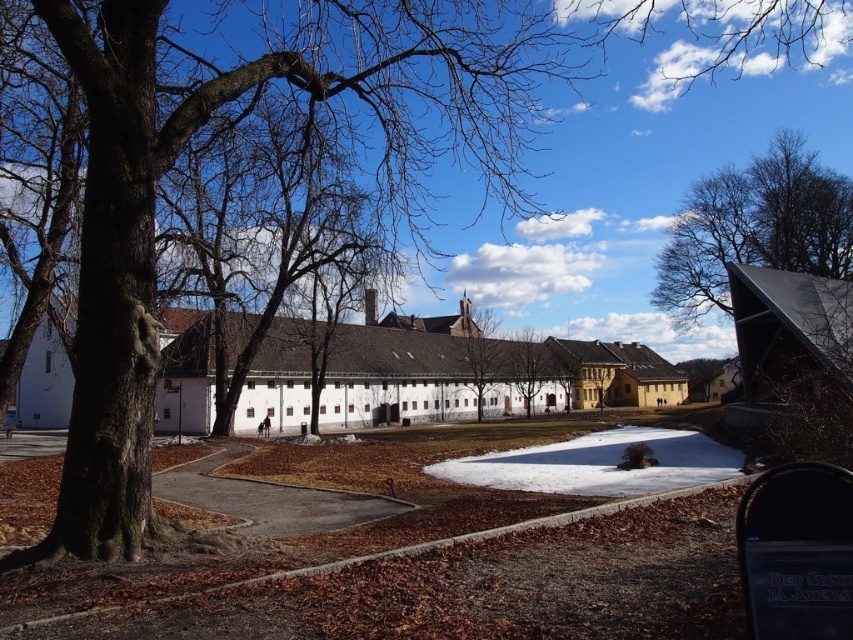
Is white matte building at center wider than bare branches at upper right?

Yes, white matte building at center is wider than bare branches at upper right.

Measure the distance between white matte building at center and camera.

They are 25.97 meters apart.

Locate an element on the screen. The image size is (853, 640). white matte building at center is located at coordinates (480, 376).

Find the location of a particular element. Image resolution: width=853 pixels, height=640 pixels. bare branches at upper right is located at coordinates (753, 227).

Can you confirm if bare branches at upper right is positioned below brown bark tree at center?

No.

Based on the photo, who is more forward, (849, 209) or (479, 360)?

Point (849, 209) is in front.

This screenshot has width=853, height=640. Find the location of `bare branches at upper right`. bare branches at upper right is located at coordinates (753, 227).

Between point (717, 257) and point (523, 404), which one is positioned behind?

The point (523, 404) is behind.

Can you confirm if bare branches at upper right is smaller than brown textured tree at center?

Incorrect, bare branches at upper right is not smaller in size than brown textured tree at center.

The width and height of the screenshot is (853, 640). Describe the element at coordinates (753, 227) in the screenshot. I see `bare branches at upper right` at that location.

Locate an element on the screen. bare branches at upper right is located at coordinates (753, 227).